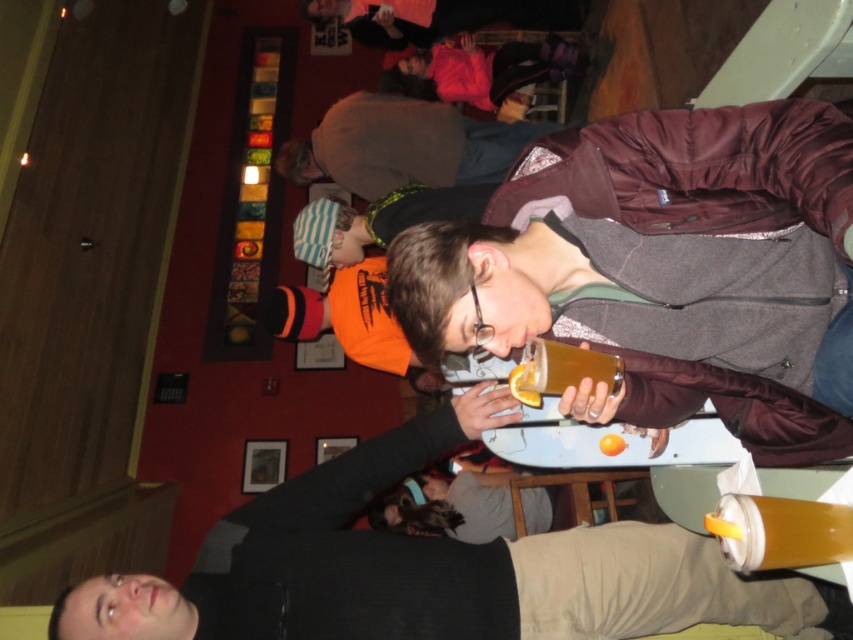
Does translucent plastic cup at lower right have a larger size compared to translucent plastic cup at upper center?

No, translucent plastic cup at lower right is not bigger than translucent plastic cup at upper center.

From the picture: Between translucent plastic cup at lower right and translucent plastic cup at upper center, which one has more height?

translucent plastic cup at lower right is taller.

Which is in front, point (843, 547) or point (540, 369)?

Point (843, 547)

What are the coordinates of `translucent plastic cup at lower right` in the screenshot? It's located at (779, 531).